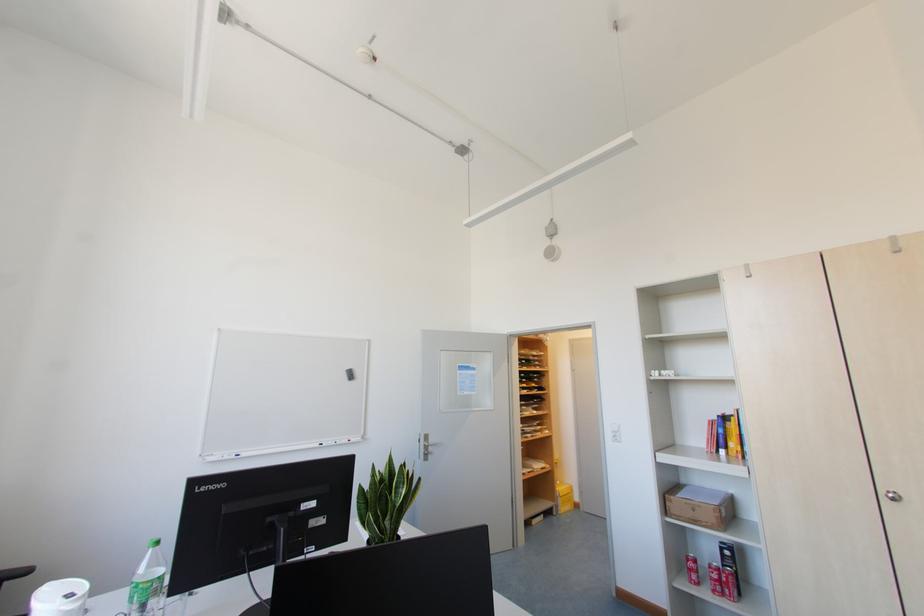
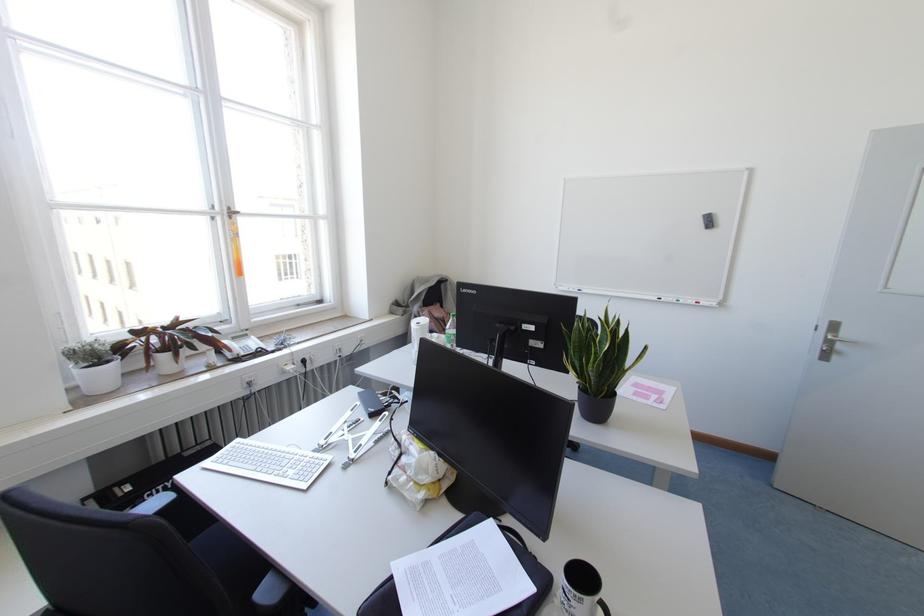
Where in the second image is the point corresponding to point 396,487 from the first image?

(599, 342)